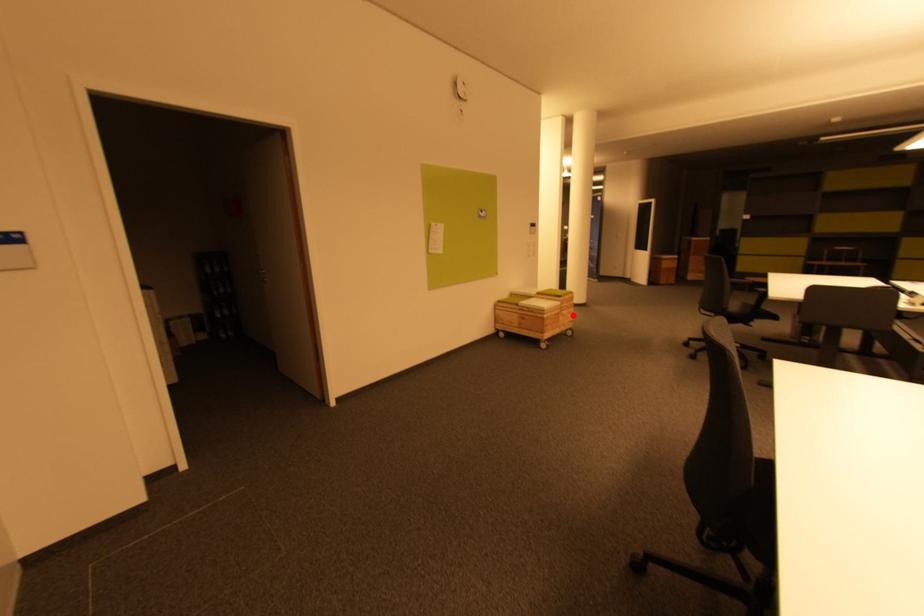
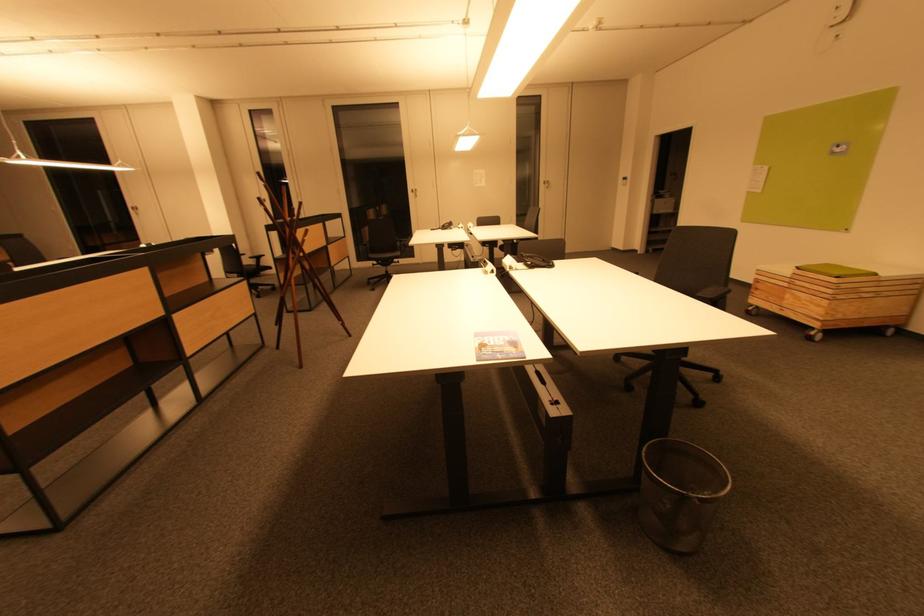
In the second image, find the point that corresponds to the highlighted location in the first image.

(816, 305)